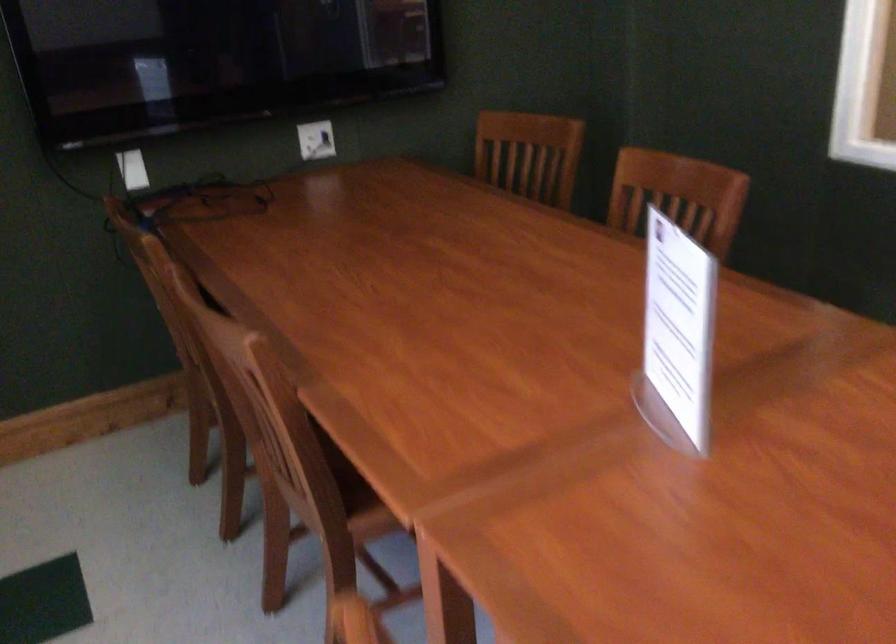
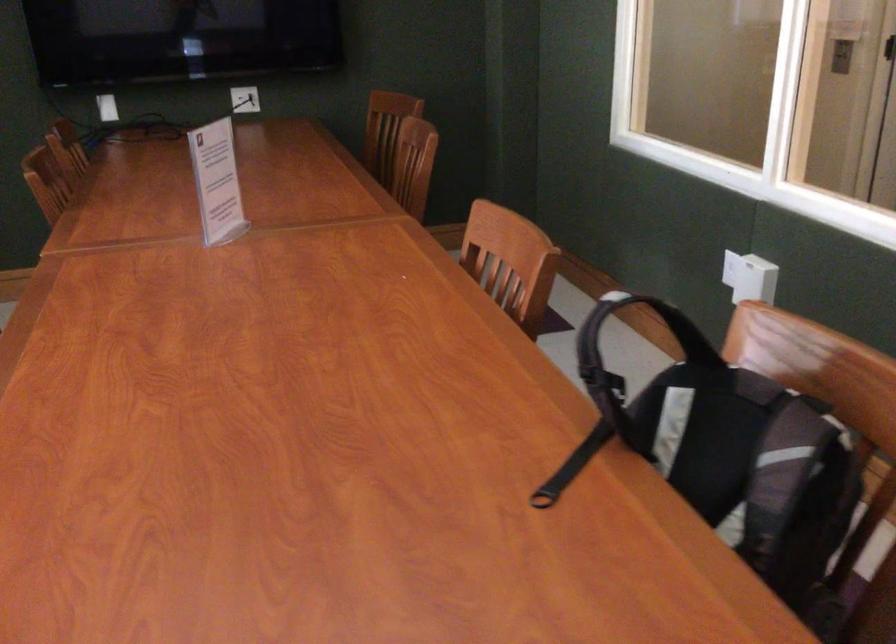
Locate, in the second image, the point that corresponds to point (319, 147) in the first image.

(245, 99)